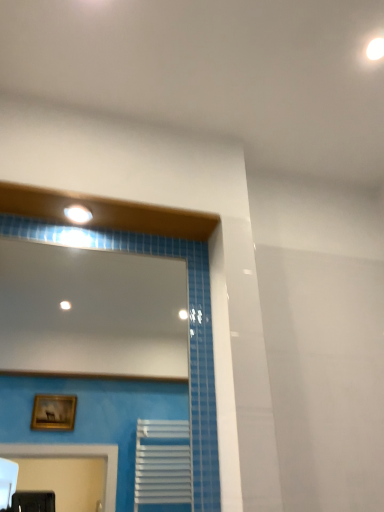
This screenshot has height=512, width=384. What do you see at coordinates (91, 312) in the screenshot?
I see `white glossy mirror at upper center` at bounding box center [91, 312].

Image resolution: width=384 pixels, height=512 pixels. What are the coordinates of `white glossy mirror at upper center` in the screenshot? It's located at (91, 312).

Find the location of a particular element. This screenshot has height=512, width=384. white glossy mirror at upper center is located at coordinates (91, 312).